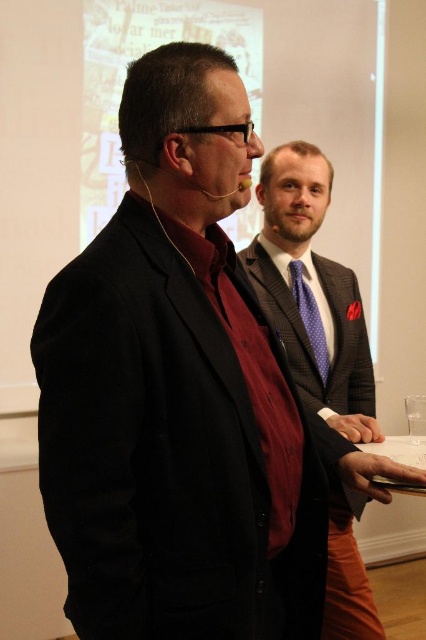
Is point (284, 147) positioned behind point (299, 260)?

No, it is not.

Does plaid wool suit at center have a greater height compared to purple dotted tie at center?

Correct, plaid wool suit at center is much taller as purple dotted tie at center.

The height and width of the screenshot is (640, 426). I want to click on plaid wool suit at center, so click(x=311, y=292).

Where is `plaid wool suit at center`? The image size is (426, 640). plaid wool suit at center is located at coordinates (311, 292).